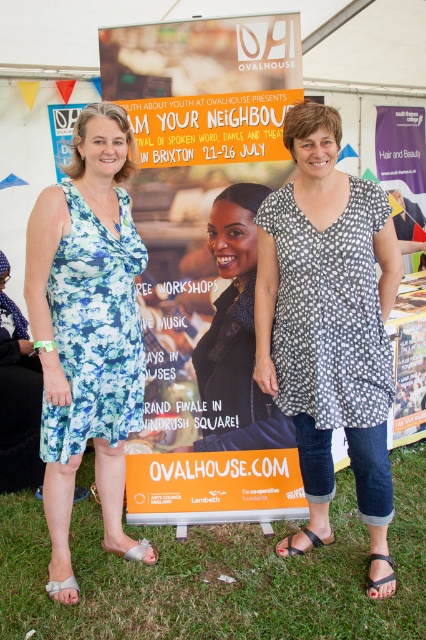
Can you confirm if black dotted dress at center is positioned above black fabric sandal at lower center?

Indeed, black dotted dress at center is positioned over black fabric sandal at lower center.

Find the location of `black dotted dress at center`. black dotted dress at center is located at coordinates (330, 310).

Describe the element at coordinates (330, 310) in the screenshot. I see `black dotted dress at center` at that location.

Find the location of a particular element. The height and width of the screenshot is (640, 426). black dotted dress at center is located at coordinates (330, 310).

Consider the image. Can you confirm if black fabric sandal at lower center is positioned above brown leather sandal at lower right?

Yes, black fabric sandal at lower center is above brown leather sandal at lower right.

This screenshot has height=640, width=426. Describe the element at coordinates (301, 541) in the screenshot. I see `black fabric sandal at lower center` at that location.

Between point (288, 547) and point (382, 554), which one is positioned in front?

Point (382, 554) is more forward.

Where is `black fabric sandal at lower center`? The image size is (426, 640). black fabric sandal at lower center is located at coordinates (301, 541).

Is blue floral dress at left to the right of floral fabric dress at left from the viewer's perspective?

In fact, blue floral dress at left is to the left of floral fabric dress at left.

Based on the photo, between blue floral dress at left and floral fabric dress at left, which one is positioned lower?

Positioned lower is blue floral dress at left.

In the scene shown: Who is more forward, (89,314) or (129,260)?

Positioned in front is point (89,314).

You are a GUI agent. You are given a task and a screenshot of the screen. Output one action in this format:
    pyautogui.click(x=<x>, y=<y>)
    Task: Click on the blue floral dress at left
    
    Given the screenshot: What is the action you would take?
    [x=86, y=323]